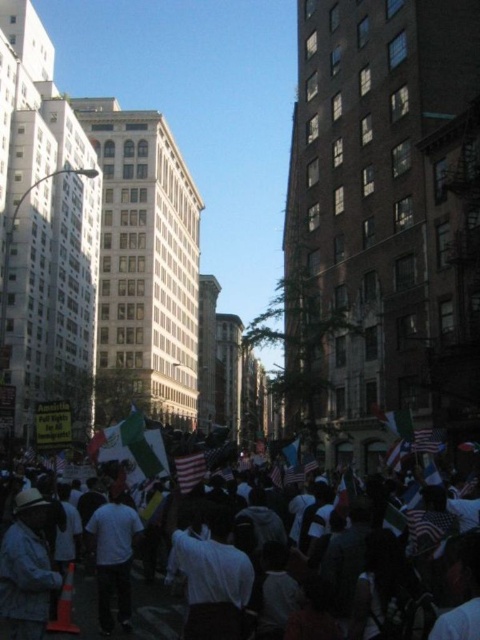
You are a photographer standing at the edge of the crowd holding a camera with a 50mm lens. You want to capture both the dark blue denim jacket at lower left and the american flag at center in a single frame without zooming. Given that the minimum distance between these two objects is 12.25 meters, can you fit both into your shot if your camera has a field of view of 46 degrees at 50mm?

The distance between the dark blue denim jacket at lower left and the american flag at center is 12.25 meters. To determine if they can fit in a 46 degree field of view, we calculate the maximum distance covered by the field of view. Using trigonometry, the maximum span would be 2 times the distance multiplied by tan of half the angle. However, since the actual distance from the camera to the subjects isnecessary for this calculation and isn provided, it is impossible to determine if they can fit without it

You are a photographer standing at the center of the street, aiming to capture a photo of the protest. There are two points of interest marked on your camera screen at coordinates point (22, 493) and point (186, 474). Which point is closer to you, the photographer?

Point (22, 493) is in front of point (186, 474), so the photographer is closer to point (22, 493).

You are a photographer trying to capture a clear shot of the white matte shirt at center and the white cotton crowd at center. Since both are white, how can you distinguish them in your photo?

The white matte shirt at center is located above the white cotton crowd at center, so you can distinguish them by their vertical positioning in the photo.